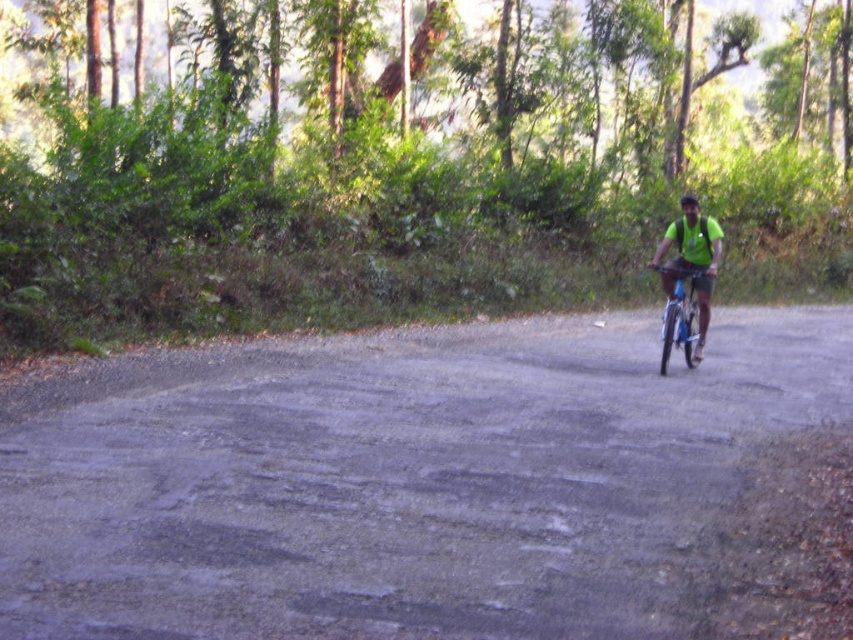
Does gray asphalt road at center come behind black matte helmet at upper center?

No.

Is point (212, 445) closer to camera compared to point (697, 205)?

Yes, it is in front of point (697, 205).

Where is `gray asphalt road at center`? Image resolution: width=853 pixels, height=640 pixels. gray asphalt road at center is located at coordinates (424, 484).

Is point (457, 579) positioned in front of point (712, 253)?

Yes, it is.

Does gray asphalt road at center appear on the right side of green matte shirt at center?

No, gray asphalt road at center is not to the right of green matte shirt at center.

Who is more distant from viewer, (323, 554) or (695, 353)?

The point (695, 353) is behind.

Where is `gray asphalt road at center`? gray asphalt road at center is located at coordinates (424, 484).

Is green matte shirt at center further to the viewer compared to black matte helmet at upper center?

No.

Does point (670, 236) come farther from viewer compared to point (694, 204)?

That is True.

Where is `green matte shirt at center`? This screenshot has height=640, width=853. green matte shirt at center is located at coordinates (692, 260).